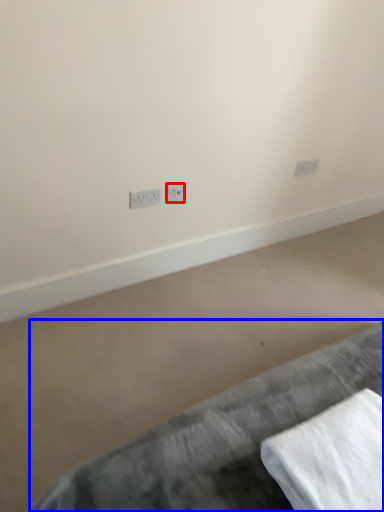
Question: Which point is further to the camera, power plugs and sockets (highlighted by a red box) or furniture (highlighted by a blue box)?

Choices:
 (A) power plugs and sockets
 (B) furniture

Answer: (A)